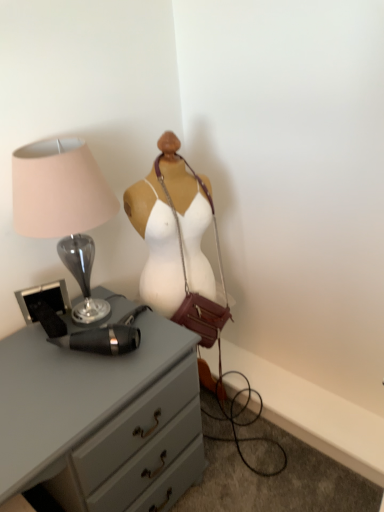
Question: Is matte gray chest of drawers at center-left bigger than leather/maroon handbag at center?

Choices:
 (A) yes
 (B) no

Answer: (A)

Question: Considering the relative sizes of matte gray chest of drawers at center-left and leather/maroon handbag at center in the image provided, is matte gray chest of drawers at center-left taller than leather/maroon handbag at center?

Choices:
 (A) yes
 (B) no

Answer: (B)

Question: Does matte gray chest of drawers at center-left contain leather/maroon handbag at center?

Choices:
 (A) no
 (B) yes

Answer: (A)

Question: Does matte gray chest of drawers at center-left lie behind leather/maroon handbag at center?

Choices:
 (A) no
 (B) yes

Answer: (A)

Question: From a real-world perspective, is matte gray chest of drawers at center-left located higher than leather/maroon handbag at center?

Choices:
 (A) no
 (B) yes

Answer: (A)

Question: Is matte gray chest of drawers at center-left wider or thinner than leather/maroon handbag at center?

Choices:
 (A) wide
 (B) thin

Answer: (A)

Question: Based on their sizes in the image, would you say matte gray chest of drawers at center-left is bigger or smaller than leather/maroon handbag at center?

Choices:
 (A) small
 (B) big

Answer: (B)

Question: From their relative heights in the image, would you say matte gray chest of drawers at center-left is taller or shorter than leather/maroon handbag at center?

Choices:
 (A) tall
 (B) short

Answer: (B)

Question: Considering their positions, is matte gray chest of drawers at center-left located in front of or behind leather/maroon handbag at center?

Choices:
 (A) behind
 (B) front

Answer: (B)

Question: From the image's perspective, relative to matte glass lamp at left, is matte gray chest of drawers at center-left above or below?

Choices:
 (A) below
 (B) above

Answer: (A)

Question: Considering the positions of matte gray chest of drawers at center-left and matte glass lamp at left in the image, is matte gray chest of drawers at center-left wider or thinner than matte glass lamp at left?

Choices:
 (A) thin
 (B) wide

Answer: (B)

Question: In terms of height, does matte gray chest of drawers at center-left look taller or shorter compared to matte glass lamp at left?

Choices:
 (A) tall
 (B) short

Answer: (A)

Question: Would you say matte gray chest of drawers at center-left is to the left or to the right of matte glass lamp at left in the picture?

Choices:
 (A) left
 (B) right

Answer: (B)

Question: From the image's perspective, is matte glass lamp at left located above or below leather/maroon handbag at center?

Choices:
 (A) below
 (B) above

Answer: (B)

Question: Is matte glass lamp at left inside the boundaries of leather/maroon handbag at center, or outside?

Choices:
 (A) inside
 (B) outside

Answer: (B)